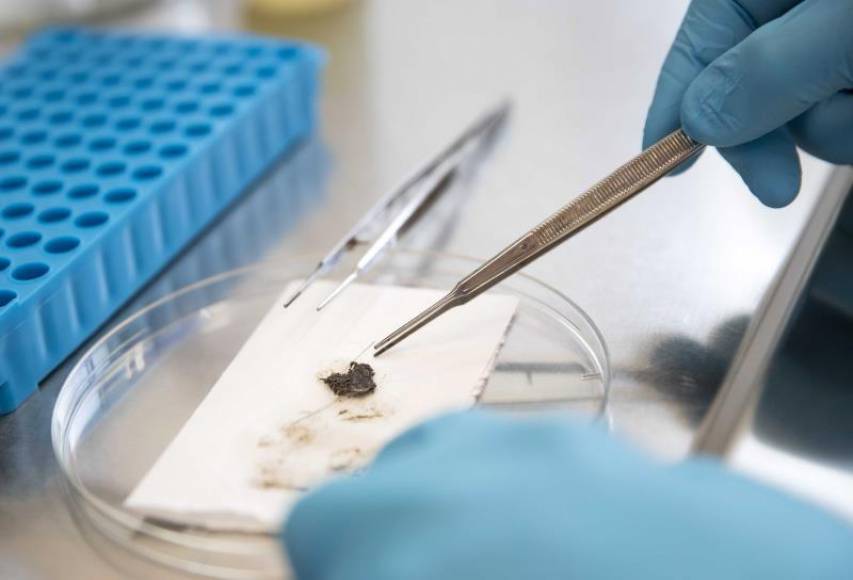
Locate an element on the screen. The height and width of the screenshot is (580, 853). vial holder is located at coordinates (188, 172).